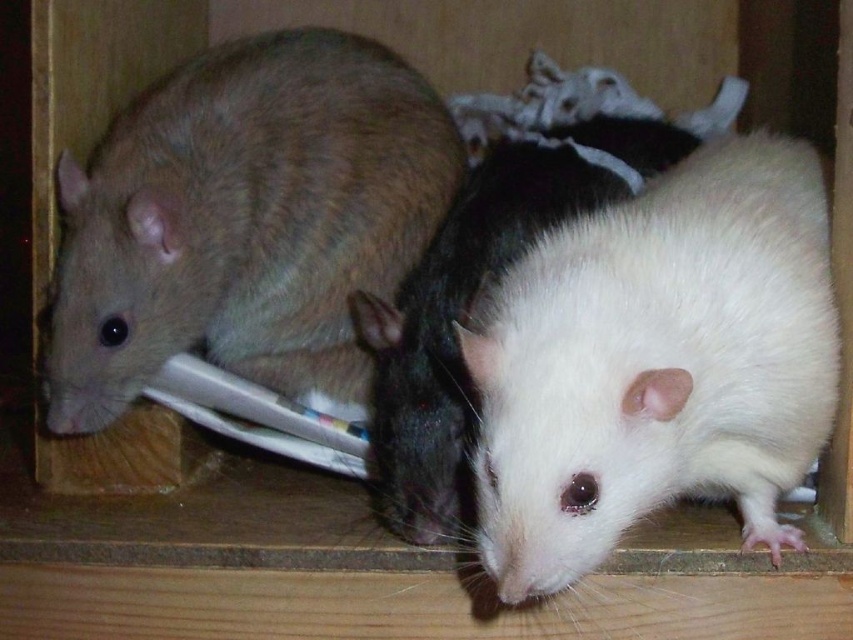
Which of these two, matte brown mouse at left or white matte fur mouse at center, stands shorter?

matte brown mouse at left

Can you confirm if matte brown mouse at left is positioned above white matte fur mouse at center?

Yes.

Between point (244, 112) and point (457, 368), which one is positioned in front?

Point (457, 368)

In order to click on matte brown mouse at left in this screenshot , I will do tap(247, 220).